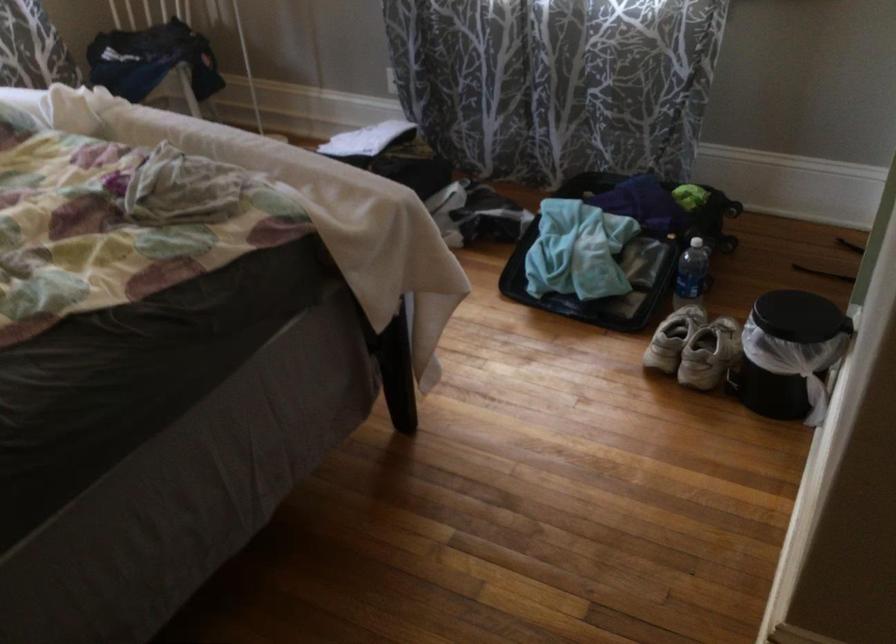
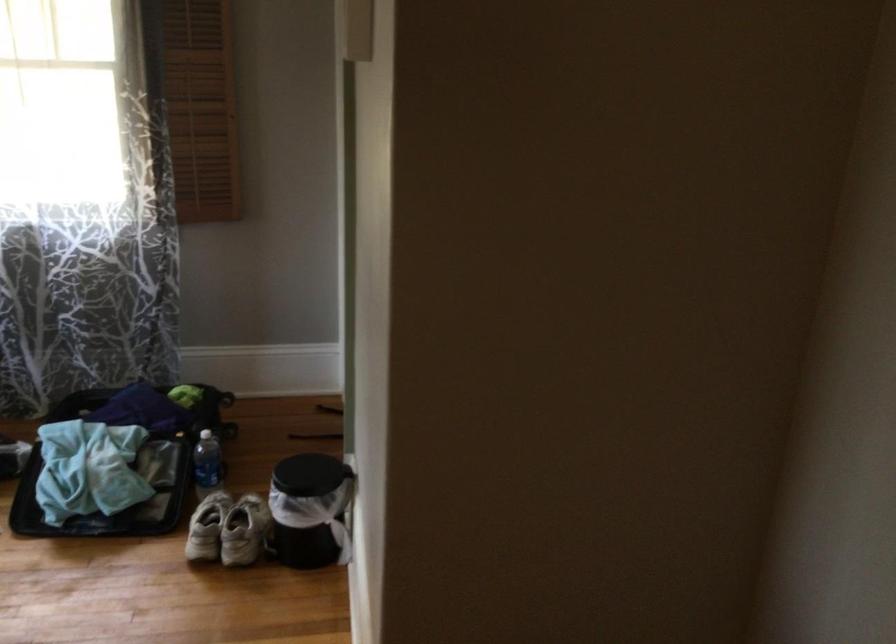
The point at (705,353) is marked in the first image. Where is the corresponding point in the second image?

(244, 531)